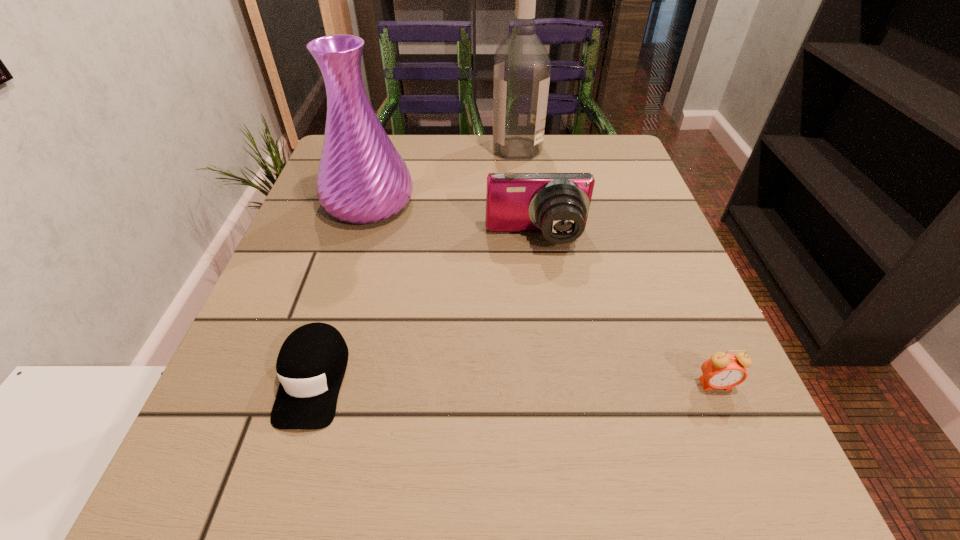
This screenshot has width=960, height=540. What are the coordinates of `object that is at the far left corner` in the screenshot? It's located at (362, 178).

The width and height of the screenshot is (960, 540). In the image, there is a desktop. Find the location of `vacant space at the far edge`. vacant space at the far edge is located at coordinates (474, 137).

Identify the location of free location at the near edge. (344, 520).

Identify the location of blank space at the left edge of the desktop. (286, 315).

This screenshot has width=960, height=540. In the image, there is a desktop. In order to click on free space at the right edge in this screenshot , I will do `click(659, 299)`.

Where is `vacant space at the near right corner of the desktop`? Image resolution: width=960 pixels, height=540 pixels. vacant space at the near right corner of the desktop is located at coordinates (701, 470).

I want to click on vacant area that lies between the farthest object and the fourth shortest object, so click(443, 176).

This screenshot has height=540, width=960. I want to click on vacant space in between the fourth shortest object and the tallest object, so click(x=443, y=176).

I want to click on empty space that is in between the tallest object and the rightmost object, so click(x=616, y=266).

Identify the location of free space between the vase and the liquor. (443, 176).